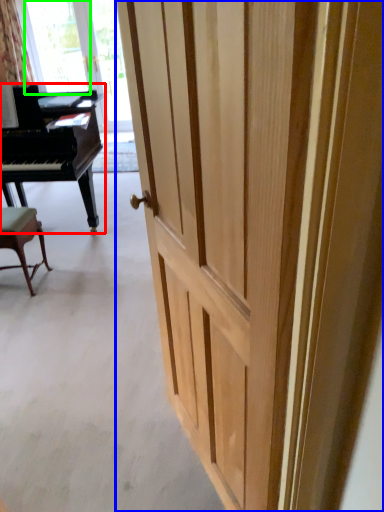
Question: Based on their relative distances, which object is farther from piano (highlighted by a red box)? Choose from door (highlighted by a blue box) and window screen (highlighted by a green box).

Choices:
 (A) door
 (B) window screen

Answer: (B)